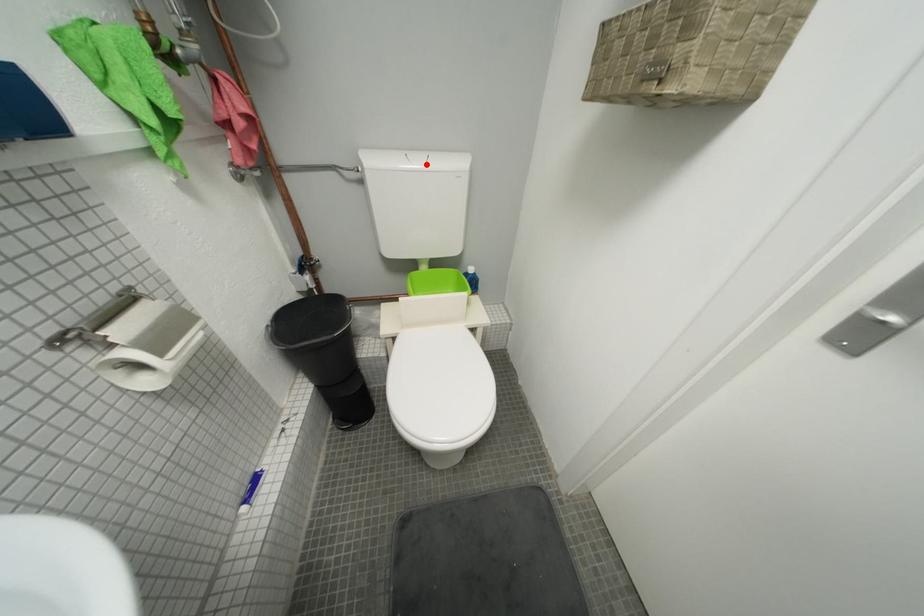
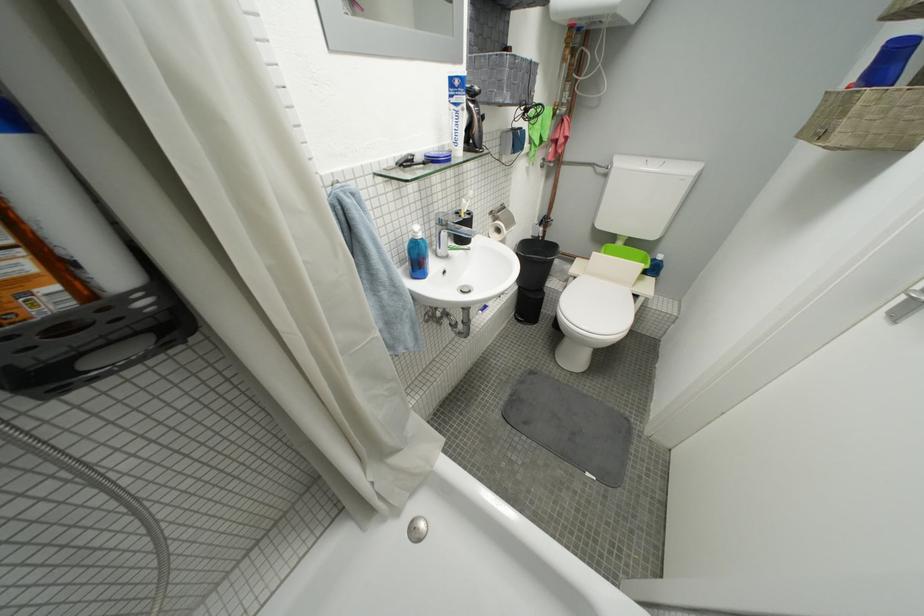
Question: I am providing you with two images of the same scene from different viewpoints. A red point is shown in image1. For the corresponding object point in image2, is it positioned nearer or farther from the camera?

Choices:
 (A) Nearer
 (B) Farther

Answer: (A)